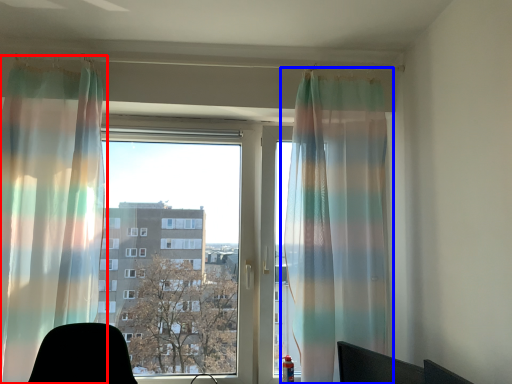
Question: Which object is further to the camera taking this photo, curtain (highlighted by a red box) or curtain (highlighted by a blue box)?

Choices:
 (A) curtain
 (B) curtain

Answer: (B)